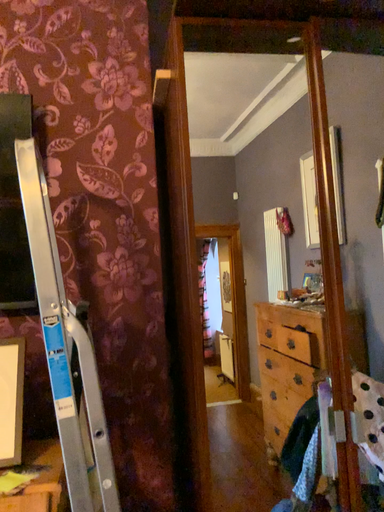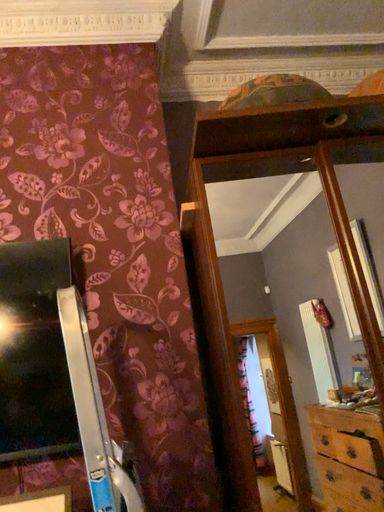
Question: Which way did the camera rotate in the video?

Choices:
 (A) rotated downward
 (B) rotated upward

Answer: (B)